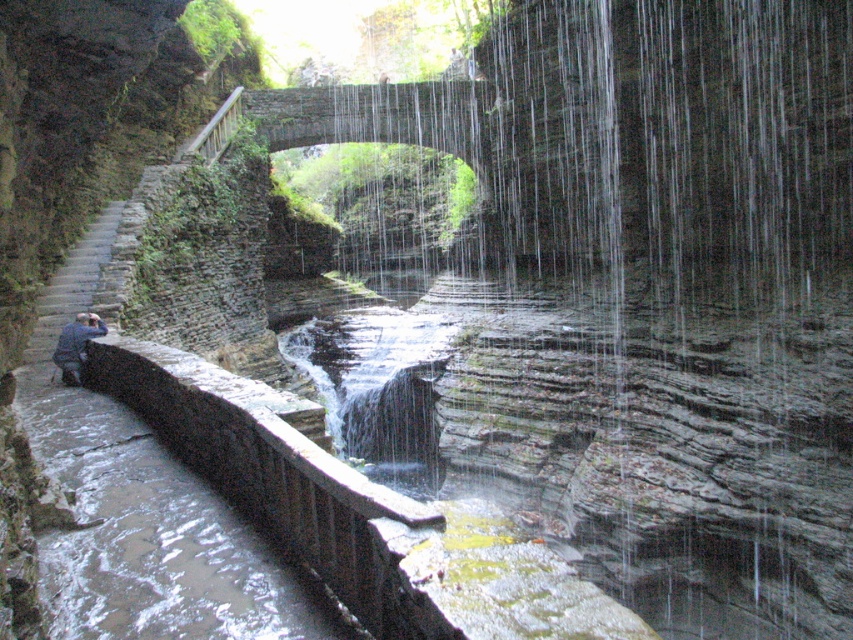
Question: Can you confirm if brown stone rail at lower left is positioned above blue denim jacket at lower left?

Choices:
 (A) no
 (B) yes

Answer: (A)

Question: Based on their relative distances, which object is farther from the blue denim jacket at lower left?

Choices:
 (A) clear water at center
 (B) brown stone rail at lower left

Answer: (A)

Question: Considering the relative positions of brown stone rail at lower left and blue denim jacket at lower left in the image provided, where is brown stone rail at lower left located with respect to blue denim jacket at lower left?

Choices:
 (A) left
 (B) right

Answer: (B)

Question: Which point is farther to the camera?

Choices:
 (A) blue denim jacket at lower left
 (B) brown stone rail at lower left

Answer: (A)

Question: Does brown stone rail at lower left have a greater width compared to blue denim jacket at lower left?

Choices:
 (A) yes
 (B) no

Answer: (A)

Question: Which object is positioned closest to the blue denim jacket at lower left?

Choices:
 (A) clear water at center
 (B) brown stone rail at lower left

Answer: (B)